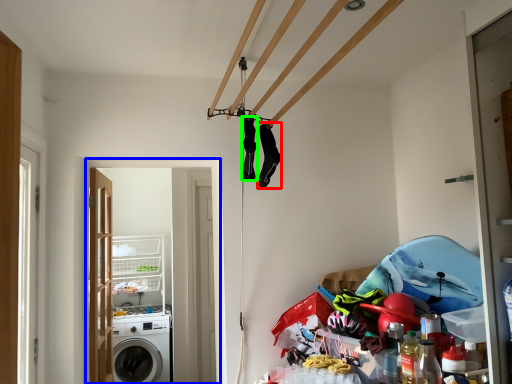
Question: Which object is the closest to the clothing (highlighted by a red box)? Choose among these: screen door (highlighted by a blue box) or clothing (highlighted by a green box).

Choices:
 (A) screen door
 (B) clothing

Answer: (B)